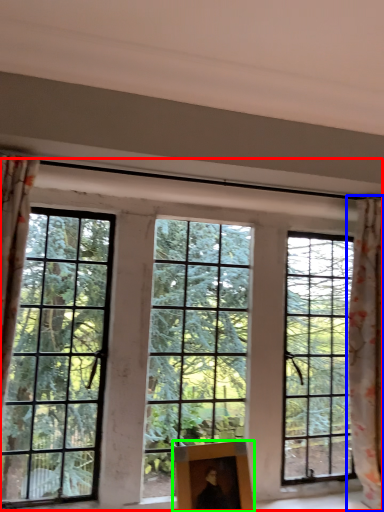
Question: Which is nearer to the window (highlighted by a red box)? curtain (highlighted by a blue box) or picture frame (highlighted by a green box).

Choices:
 (A) curtain
 (B) picture frame

Answer: (B)